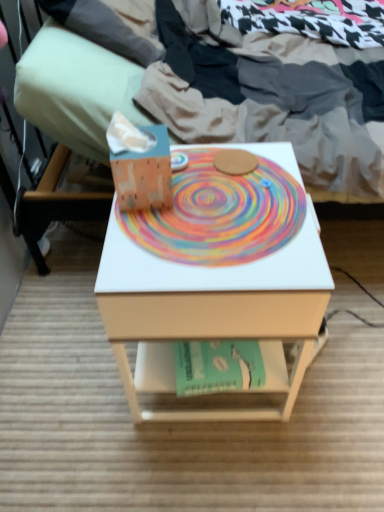
You are a GUI agent. You are given a task and a screenshot of the screen. Output one action in this format:
    pyautogui.click(x=<x>, y=<y>)
    Task: Click on the empty space that is to the right of white matte desk at center
    
    Given the screenshot: What is the action you would take?
    pyautogui.click(x=346, y=354)